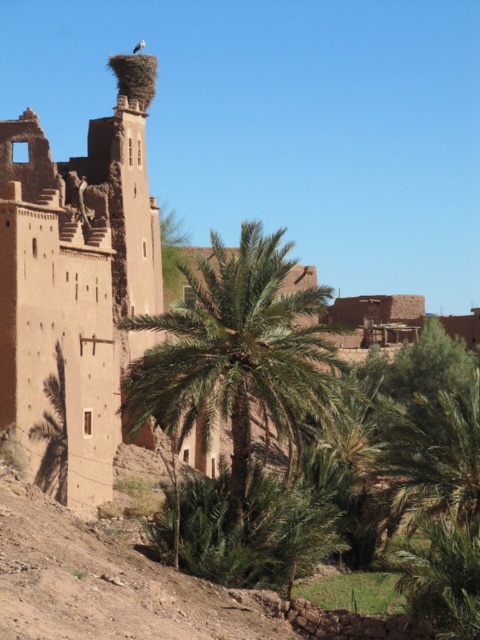
Question: Considering the relative positions of green leafy palm at center and brown nest at upper center in the image provided, where is green leafy palm at center located with respect to brown nest at upper center?

Choices:
 (A) left
 (B) right

Answer: (B)

Question: Considering the real-world distances, which object is closest to the green leafy palm at center?

Choices:
 (A) brown mudbrick ruins at upper center
 (B) green leafy palm at lower left

Answer: (A)

Question: Which object appears farthest from the camera in this image?

Choices:
 (A) green leafy palm at lower left
 (B) green leafy palm at center
 (C) brown nest at upper center

Answer: (C)

Question: Is brown mudbrick ruins at upper center smaller than green leafy palm at center?

Choices:
 (A) yes
 (B) no

Answer: (A)

Question: Which point is farther from the camera taking this photo?

Choices:
 (A) click(x=64, y=504)
 (B) click(x=133, y=51)
 (C) click(x=276, y=256)

Answer: (B)

Question: Is brown mudbrick ruins at upper center smaller than green leafy palm at lower left?

Choices:
 (A) yes
 (B) no

Answer: (B)